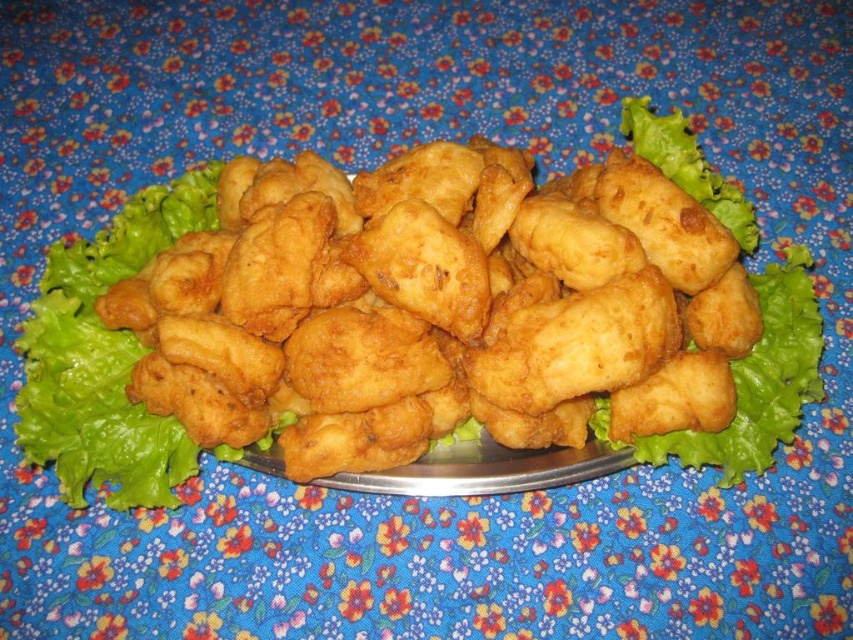
You are a delivery person who needs to place a small container on the table. The container is 3 feet wide. The point where you want to place it is at point (318, 161). Can you fit the container there?

The distance between the points is 4.07 feet, which is greater than the container width of 3 feet. Yes, the container can be placed there.

You are a food critic sitting at a table with the plate of fried nuggets. You want to take a bite of the golden fried nugget at center. Can you reach it without moving your hand from its current position?

The golden fried nugget at center is 3.42 feet away from viewer. Since the average human arm length is about 2.5 feet, you cannot reach the nugget without moving your hand.

You are a food critic evaluating the presentation of this dish. Based on the image, which item is shorter in height between the golden fried nugget at center and the green leafy lettuce at center?

The golden fried nugget at center is shorter in height compared to the green leafy lettuce at center.